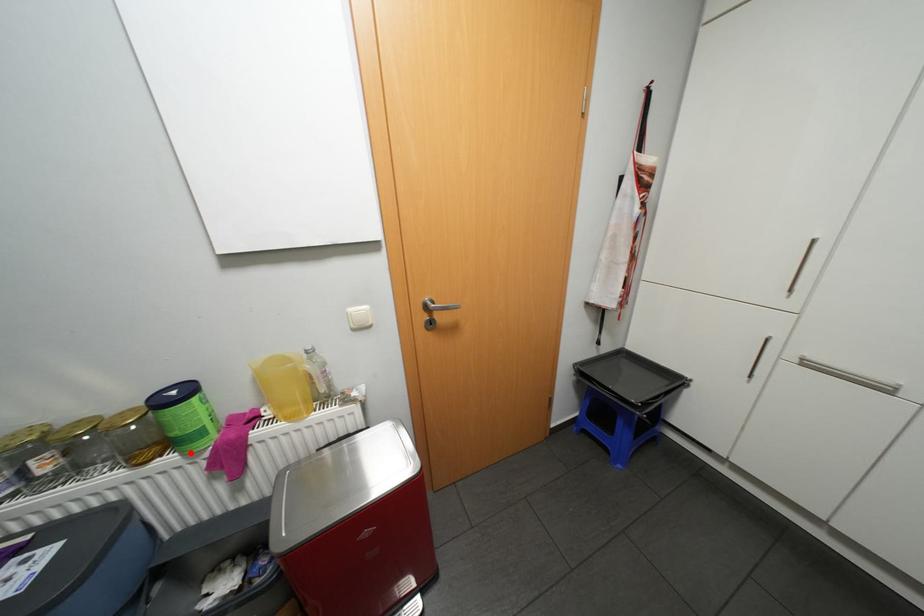
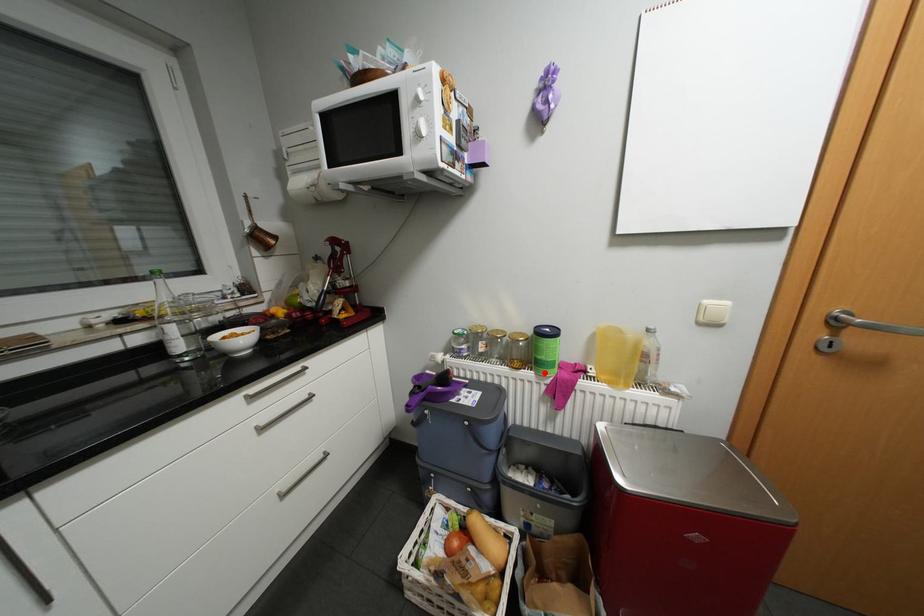
I am providing you with two images of the same scene from different viewpoints. A red point is marked on the first image and another point is marked on the second image. Is the red point in image1 aligned with the point shown in image2?

Yes